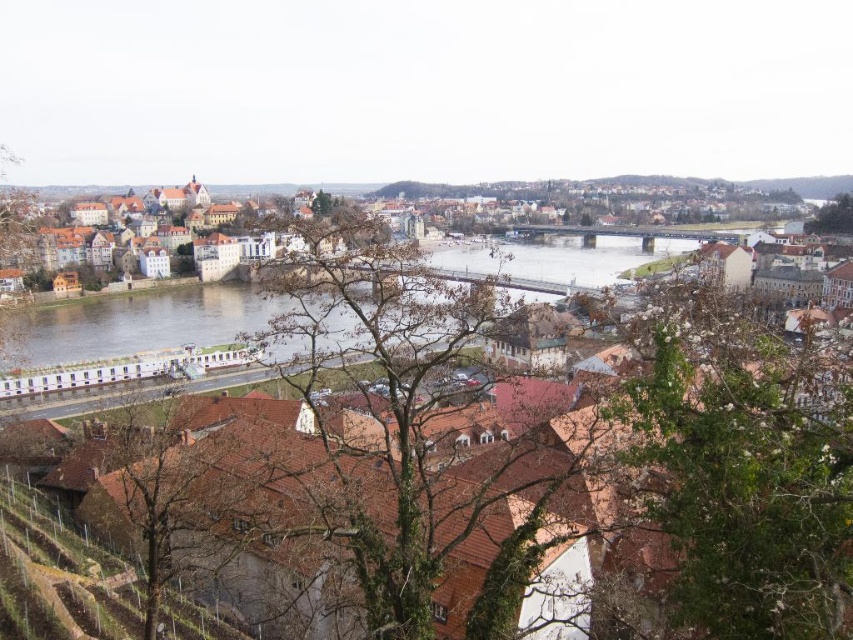
You are standing at the point labeled point (659, 230) in the image. What is the color of the surface you are currently standing on?

The point (659, 230) is on brown tiled roofs at center, so the surface you are standing on is brown in color.

You are standing at the center of the riverside town and want to find the green leafy tree at lower right. According to the map coordinates, where should you look relative to your current position?

The green leafy tree at lower right is located at point 0.734 on the x axis and 0.870 on the y axis, so you should look to the lower right direction from your current position.